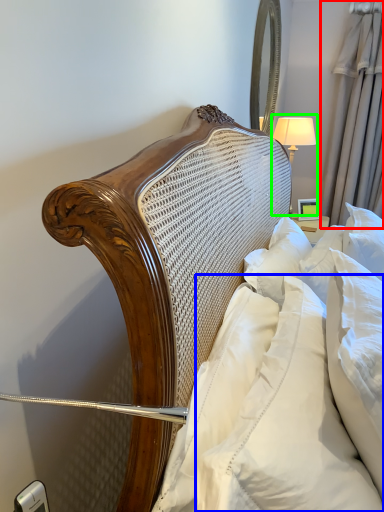
Question: Considering the real-world distances, which object is farthest from curtain (highlighted by a red box)? pillow (highlighted by a blue box) or bedside lamp (highlighted by a green box)?

Choices:
 (A) pillow
 (B) bedside lamp

Answer: (A)